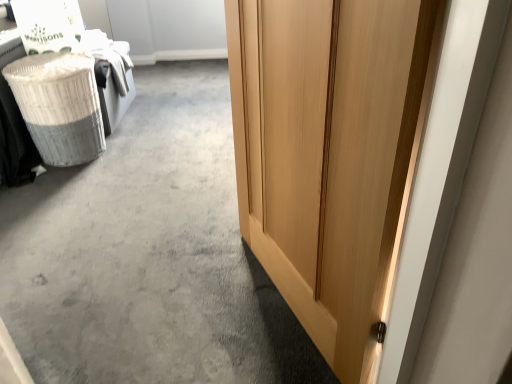
Describe the element at coordinates (59, 106) in the screenshot. I see `white wicker laundry basket at left` at that location.

Locate an element on the screen. This screenshot has width=512, height=384. white wicker laundry basket at left is located at coordinates (59, 106).

The image size is (512, 384). What do you see at coordinates (327, 153) in the screenshot?
I see `light wood door at right` at bounding box center [327, 153].

I want to click on wooden door at right, so (x=148, y=255).

The height and width of the screenshot is (384, 512). Identify the location of white wicker laundry basket at left. (59, 106).

Looking at this image, considering the relative sizes of light wood door at right and white wicker laundry basket at left in the image provided, is light wood door at right bigger than white wicker laundry basket at left?

Yes, light wood door at right is bigger than white wicker laundry basket at left.

How far apart are light wood door at right and white wicker laundry basket at left?

light wood door at right and white wicker laundry basket at left are 1.45 meters apart.

From a real-world perspective, is light wood door at right located higher than white wicker laundry basket at left?

Indeed, from a real-world perspective, light wood door at right stands above white wicker laundry basket at left.

Looking at this image, between white wicker laundry basket at left and wooden door at right, which one has larger width?

wooden door at right is wider.

From a real-world perspective, is white wicker laundry basket at left above or below wooden door at right?

white wicker laundry basket at left is situated higher than wooden door at right in the real world.

From the picture: From the image's perspective, which is below, white wicker laundry basket at left or wooden door at right?

wooden door at right, from the image's perspective.

How distant is white wicker laundry basket at left from wooden door at right?

white wicker laundry basket at left is 19.51 inches away from wooden door at right.

In terms of width, does light wood door at right look wider or thinner when compared to wooden door at right?

light wood door at right is thinner than wooden door at right.

The height and width of the screenshot is (384, 512). Identify the location of concrete that appears on the left of light wood door at right. (148, 255).

Does light wood door at right have a larger size compared to wooden door at right?

Incorrect, light wood door at right is not larger than wooden door at right.

Can you confirm if light wood door at right is taller than wooden door at right?

Yes, light wood door at right is taller than wooden door at right.

Is wooden door at right outside of white wicker laundry basket at left?

Yes, wooden door at right is located beyond the bounds of white wicker laundry basket at left.

From the image's perspective, which one is positioned lower, wooden door at right or white wicker laundry basket at left?

wooden door at right is shown below in the image.

Between wooden door at right and white wicker laundry basket at left, which one has more height?

Standing taller between the two is white wicker laundry basket at left.

Is wooden door at right positioned with its back to white wicker laundry basket at left?

No, wooden door at right is not facing the opposite direction of white wicker laundry basket at left.

Is light wood door at right at the back of white wicker laundry basket at left?

No, white wicker laundry basket at left is not facing away from light wood door at right.

How far apart are white wicker laundry basket at left and light wood door at right?

white wicker laundry basket at left and light wood door at right are 1.45 meters apart.

Are white wicker laundry basket at left and light wood door at right beside each other?

white wicker laundry basket at left and light wood door at right are clearly separated.

Between white wicker laundry basket at left and light wood door at right, which one has less height?

Standing shorter between the two is white wicker laundry basket at left.

Which of these two, wooden door at right or light wood door at right, is thinner?

With smaller width is light wood door at right.

From the image's perspective, which is below, wooden door at right or light wood door at right?

light wood door at right, from the image's perspective.

Looking at this image, from a real-world perspective, between wooden door at right and light wood door at right, who is vertically lower?

wooden door at right, from a real-world perspective.

The image size is (512, 384). Identify the location of door above the white wicker laundry basket at left (from a real-world perspective). (327, 153).

Identify the location of concrete in front of the white wicker laundry basket at left. This screenshot has height=384, width=512. (148, 255).

When comparing their distances from light wood door at right, does wooden door at right or white wicker laundry basket at left seem further?

Based on the image, white wicker laundry basket at left appears to be further to light wood door at right.

From the picture: Based on their spatial positions, is light wood door at right or white wicker laundry basket at left closer to wooden door at right?

white wicker laundry basket at left is closer to wooden door at right.

Which object lies further to the anchor point wooden door at right, white wicker laundry basket at left or light wood door at right?

light wood door at right is further to wooden door at right.

Considering their positions, is light wood door at right positioned closer to white wicker laundry basket at left than wooden door at right?

wooden door at right is closer to white wicker laundry basket at left.

When comparing their distances from white wicker laundry basket at left, does wooden door at right or light wood door at right seem further?

light wood door at right is further to white wicker laundry basket at left.

Consider the image. Considering their positions, is white wicker laundry basket at left positioned closer to light wood door at right than wooden door at right?

wooden door at right is closer to light wood door at right.

Where is `concrete between light wood door at right and white wicker laundry basket at left along the z-axis`? concrete between light wood door at right and white wicker laundry basket at left along the z-axis is located at coordinates (148, 255).